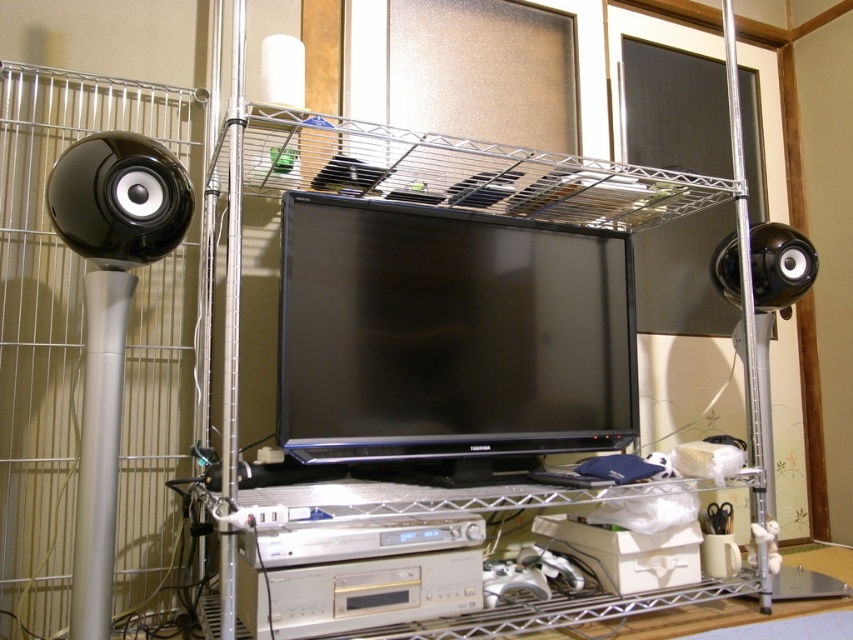
You are setting up a new entertainment system and need to place a rectangular box that is 12 inches long. You have space on the shelf with the satin black monitor at center and the glossy black speaker at left. Can the box fit horizontally between them?

The satin black monitor at center is bigger than the glossy black speaker at left, so there might not be enough space for the 12 inch box to fit horizontally between them. Check the exact dimensions before placing the box.

You are setting up a new monitor and want to place it on the shelf where the black glossy flat screen tv at center is located. Can the satin black monitor at center fit on that shelf without overlapping the TV?

The satin black monitor at center is bigger than the black glossy flat screen tv at center. Since the monitor is larger, it might not fit on the same shelf without overlapping the TV unless there is sufficient space available.

You are a delivery person who needs to place a new camera on the middle shelf next to the black glossy flat screen tv at center. The camera requires 1.5 feet of space to function properly. Is there enough space between the tv and the edge of the shelf to accommodate it?

The black glossy flat screen tv at center and camera are 4.49 feet apart from each other, so there is sufficient space to place the camera next to the tv as the required 1.5 feet is well within the available distance.